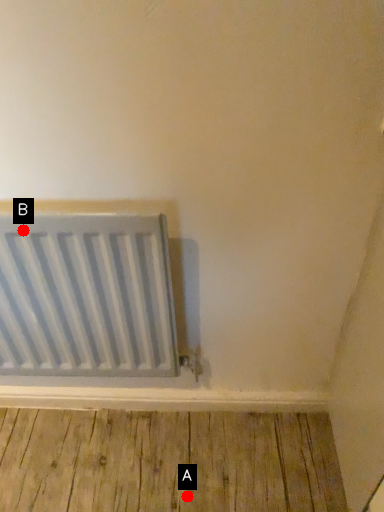
Question: Two points are circled on the image, labeled by A and B beside each circle. Which point is further to the camera?

Choices:
 (A) A is further
 (B) B is further

Answer: (A)